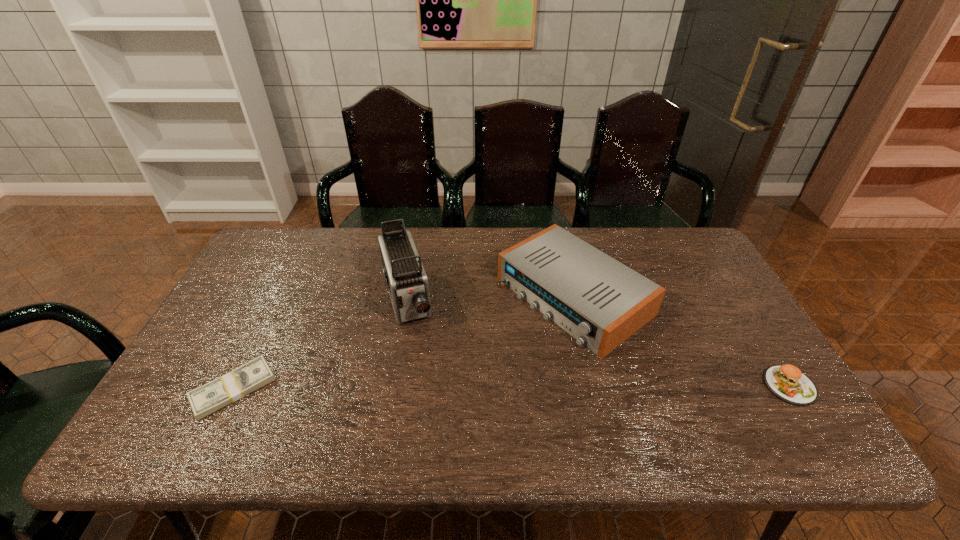
Locate an element on the screen. object situated at the left edge is located at coordinates (204, 400).

At what (x,y) coordinates should I click in order to perform the action: click on object present at the right edge. Please return your answer as a coordinate pair (x, y). Looking at the image, I should click on (787, 382).

Identify the location of object that is at the near left corner. (204, 400).

Where is `object present at the near right corner`? The width and height of the screenshot is (960, 540). object present at the near right corner is located at coordinates (787, 382).

At what (x,y) coordinates should I click in order to perform the action: click on vacant space at the far edge of the desktop. Please return your answer as a coordinate pair (x, y). The image size is (960, 540). Looking at the image, I should click on (499, 242).

At what (x,y) coordinates should I click in order to perform the action: click on vacant space at the near edge of the desktop. Please return your answer as a coordinate pair (x, y). This screenshot has height=540, width=960. Looking at the image, I should click on (657, 402).

Locate an element on the screen. The width and height of the screenshot is (960, 540). blank space at the right edge of the desktop is located at coordinates (737, 350).

In the image, there is a desktop. Identify the location of vacant space at the far left corner. This screenshot has height=540, width=960. (263, 247).

Locate an element on the screen. Image resolution: width=960 pixels, height=540 pixels. blank space at the far right corner is located at coordinates (680, 245).

Where is `vacant space that is in between the rightmost object and the second object from right to left`? Image resolution: width=960 pixels, height=540 pixels. vacant space that is in between the rightmost object and the second object from right to left is located at coordinates (682, 341).